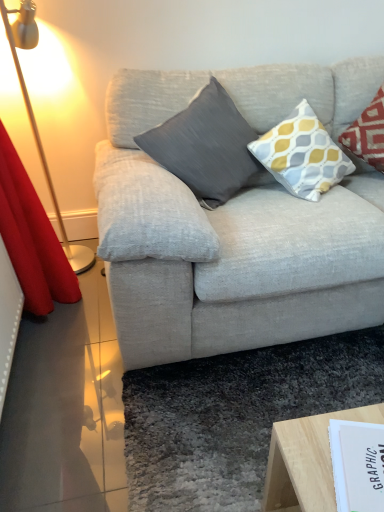
Image resolution: width=384 pixels, height=512 pixels. What do you see at coordinates (358, 466) in the screenshot?
I see `white paper at lower right` at bounding box center [358, 466].

What do you see at coordinates (302, 154) in the screenshot?
I see `yellow and gray patterned pillow at upper right, marked as the first pillow in a right-to-left arrangement` at bounding box center [302, 154].

Where is `matte gray pillow at center, placed as the 1th pillow when sorted from left to right`? The image size is (384, 512). matte gray pillow at center, placed as the 1th pillow when sorted from left to right is located at coordinates (206, 147).

Considering the relative sizes of metallic gold floor lamp at left and white paper at lower right in the image provided, is metallic gold floor lamp at left taller than white paper at lower right?

Indeed, metallic gold floor lamp at left has a greater height compared to white paper at lower right.

Which point is more distant from viewer, (34, 12) or (356, 464)?

The point (34, 12) is behind.

Which object is positioned more to the right, metallic gold floor lamp at left or white paper at lower right?

white paper at lower right is more to the right.

Does white paper at lower right have a lesser height compared to metallic gold floor lamp at left?

Correct, white paper at lower right is not as tall as metallic gold floor lamp at left.

Which object is further away from the camera, white paper at lower right or metallic gold floor lamp at left?

metallic gold floor lamp at left is further away from the camera.

Is white paper at lower right smaller than metallic gold floor lamp at left?

Indeed, white paper at lower right has a smaller size compared to metallic gold floor lamp at left.

Is white paper at lower right far from metallic gold floor lamp at left?

That's right, there is a large distance between white paper at lower right and metallic gold floor lamp at left.

Which of these two, white paper at lower right or yellow and gray patterned pillow at upper right, the second pillow in the left-to-right sequence, is thinner?

white paper at lower right.

Consider the image. Is white paper at lower right not close to yellow and gray patterned pillow at upper right, the second pillow in the left-to-right sequence?

white paper at lower right is positioned a significant distance from yellow and gray patterned pillow at upper right, the second pillow in the left-to-right sequence.

From the image's perspective, is white paper at lower right on top of yellow and gray patterned pillow at upper right, the second pillow in the left-to-right sequence?

No, from the image's perspective, white paper at lower right is not over yellow and gray patterned pillow at upper right, the second pillow in the left-to-right sequence.

From a real-world perspective, which is physically below, white paper at lower right or yellow and gray patterned pillow at upper right, the second pillow in the left-to-right sequence?

white paper at lower right, from a real-world perspective.

Does yellow and gray patterned pillow at upper right, the second pillow in the left-to-right sequence, have a greater height compared to matte gray pillow at center, placed as the 1th pillow when sorted from left to right?

In fact, yellow and gray patterned pillow at upper right, the second pillow in the left-to-right sequence, may be shorter than matte gray pillow at center, placed as the 1th pillow when sorted from left to right.

Can you tell me how much yellow and gray patterned pillow at upper right, the second pillow in the left-to-right sequence, and matte gray pillow at center, the 2th pillow viewed from the right, differ in facing direction?

0.000588 degrees.

Visually, is yellow and gray patterned pillow at upper right, marked as the first pillow in a right-to-left arrangement, positioned to the left or to the right of matte gray pillow at center, the 2th pillow viewed from the right?

Clearly, yellow and gray patterned pillow at upper right, marked as the first pillow in a right-to-left arrangement, is on the right of matte gray pillow at center, the 2th pillow viewed from the right, in the image.

Which of these two, yellow and gray patterned pillow at upper right, the second pillow in the left-to-right sequence, or matte gray pillow at center, the 2th pillow viewed from the right, is wider?

Wider between the two is matte gray pillow at center, the 2th pillow viewed from the right.

Which is correct: yellow and gray patterned pillow at upper right, the second pillow in the left-to-right sequence, is inside metallic gold floor lamp at left, or outside of it?

yellow and gray patterned pillow at upper right, the second pillow in the left-to-right sequence, cannot be found inside metallic gold floor lamp at left.

Is yellow and gray patterned pillow at upper right, the second pillow in the left-to-right sequence, with metallic gold floor lamp at left?

yellow and gray patterned pillow at upper right, the second pillow in the left-to-right sequence, and metallic gold floor lamp at left are clearly separated.

There is a metallic gold floor lamp at left. Where is `the 2nd pillow above it (from the image's perspective)`? the 2nd pillow above it (from the image's perspective) is located at coordinates (302, 154).

Considering the relative sizes of metallic gold floor lamp at left and matte gray pillow at center, the 2th pillow viewed from the right, in the image provided, is metallic gold floor lamp at left taller than matte gray pillow at center, the 2th pillow viewed from the right,?

Indeed, metallic gold floor lamp at left has a greater height compared to matte gray pillow at center, the 2th pillow viewed from the right.

Could you tell me if metallic gold floor lamp at left is facing matte gray pillow at center, the 2th pillow viewed from the right?

Yes, metallic gold floor lamp at left is aimed at matte gray pillow at center, the 2th pillow viewed from the right.

Considering the sizes of objects metallic gold floor lamp at left and matte gray pillow at center, the 2th pillow viewed from the right, in the image provided, who is bigger, metallic gold floor lamp at left or matte gray pillow at center, the 2th pillow viewed from the right,?

Bigger between the two is metallic gold floor lamp at left.

Is matte gray pillow at center, the 2th pillow viewed from the right, far from yellow and gray patterned pillow at upper right, the second pillow in the left-to-right sequence?

That's not correct — matte gray pillow at center, the 2th pillow viewed from the right, is a little close to yellow and gray patterned pillow at upper right, the second pillow in the left-to-right sequence.

Can you confirm if matte gray pillow at center, the 2th pillow viewed from the right, is taller than yellow and gray patterned pillow at upper right, the second pillow in the left-to-right sequence?

Yes, matte gray pillow at center, the 2th pillow viewed from the right, is taller than yellow and gray patterned pillow at upper right, the second pillow in the left-to-right sequence.

Is matte gray pillow at center, placed as the 1th pillow when sorted from left to right, aimed at yellow and gray patterned pillow at upper right, the second pillow in the left-to-right sequence?

No, matte gray pillow at center, placed as the 1th pillow when sorted from left to right, is not oriented towards yellow and gray patterned pillow at upper right, the second pillow in the left-to-right sequence.

From the image's perspective, is matte gray pillow at center, the 2th pillow viewed from the right, located beneath yellow and gray patterned pillow at upper right, marked as the first pillow in a right-to-left arrangement?

Yes, from the image's perspective, matte gray pillow at center, the 2th pillow viewed from the right, is beneath yellow and gray patterned pillow at upper right, marked as the first pillow in a right-to-left arrangement.

Image resolution: width=384 pixels, height=512 pixels. In order to click on paperback book below the metallic gold floor lamp at left (from the image's perspective) in this screenshot , I will do `click(358, 466)`.

The height and width of the screenshot is (512, 384). There is a white paper at lower right. In order to click on table lamp above it (from a real-world perspective) in this screenshot , I will do `click(34, 116)`.

Which object lies further to the anchor point metallic gold floor lamp at left, yellow and gray patterned pillow at upper right, marked as the first pillow in a right-to-left arrangement, or matte gray pillow at center, placed as the 1th pillow when sorted from left to right?

The object further to metallic gold floor lamp at left is yellow and gray patterned pillow at upper right, marked as the first pillow in a right-to-left arrangement.

Which object lies further to the anchor point white paper at lower right, matte gray pillow at center, the 2th pillow viewed from the right, or metallic gold floor lamp at left?

metallic gold floor lamp at left.

From the image, which object appears to be nearer to white paper at lower right, metallic gold floor lamp at left or matte gray pillow at center, placed as the 1th pillow when sorted from left to right?

matte gray pillow at center, placed as the 1th pillow when sorted from left to right, is positioned closer to the anchor white paper at lower right.

Based on their spatial positions, is matte gray pillow at center, the 2th pillow viewed from the right, or yellow and gray patterned pillow at upper right, marked as the first pillow in a right-to-left arrangement, closer to metallic gold floor lamp at left?

matte gray pillow at center, the 2th pillow viewed from the right, is closer to metallic gold floor lamp at left.

When comparing their distances from white paper at lower right, does matte gray pillow at center, the 2th pillow viewed from the right, or yellow and gray patterned pillow at upper right, the second pillow in the left-to-right sequence, seem further?

Among the two, yellow and gray patterned pillow at upper right, the second pillow in the left-to-right sequence, is located further to white paper at lower right.

Based on their spatial positions, is white paper at lower right or metallic gold floor lamp at left closer to matte gray pillow at center, the 2th pillow viewed from the right?

Based on the image, metallic gold floor lamp at left appears to be nearer to matte gray pillow at center, the 2th pillow viewed from the right.

From the image, which object appears to be nearer to yellow and gray patterned pillow at upper right, marked as the first pillow in a right-to-left arrangement, white paper at lower right or metallic gold floor lamp at left?

Based on the image, metallic gold floor lamp at left appears to be nearer to yellow and gray patterned pillow at upper right, marked as the first pillow in a right-to-left arrangement.

From the image, which object appears to be farther from matte gray pillow at center, placed as the 1th pillow when sorted from left to right, yellow and gray patterned pillow at upper right, marked as the first pillow in a right-to-left arrangement, or metallic gold floor lamp at left?

metallic gold floor lamp at left.

In order to click on pillow between metallic gold floor lamp at left and white paper at lower right from left to right in this screenshot , I will do `click(206, 147)`.

At what (x,y) coordinates should I click in order to perform the action: click on paperback book situated between metallic gold floor lamp at left and yellow and gray patterned pillow at upper right, marked as the first pillow in a right-to-left arrangement, from left to right. Please return your answer as a coordinate pair (x, y). Image resolution: width=384 pixels, height=512 pixels. Looking at the image, I should click on [358, 466].

In order to click on pillow between yellow and gray patterned pillow at upper right, marked as the first pillow in a right-to-left arrangement, and white paper at lower right, in the vertical direction in this screenshot , I will do `click(206, 147)`.

Image resolution: width=384 pixels, height=512 pixels. Find the location of `pillow located between metallic gold floor lamp at left and yellow and gray patterned pillow at upper right, the second pillow in the left-to-right sequence, in the left-right direction`. pillow located between metallic gold floor lamp at left and yellow and gray patterned pillow at upper right, the second pillow in the left-to-right sequence, in the left-right direction is located at coordinates (206, 147).